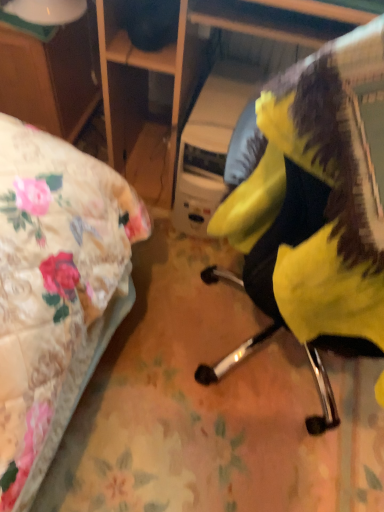
Question: From the image's perspective, is yellow fabric chair at center above or below wooden desk at left?

Choices:
 (A) below
 (B) above

Answer: (A)

Question: Considering the positions of point (327, 200) and point (49, 115), is point (327, 200) closer or farther from the camera than point (49, 115)?

Choices:
 (A) farther
 (B) closer

Answer: (B)

Question: In terms of height, does yellow fabric chair at center look taller or shorter compared to wooden desk at left?

Choices:
 (A) short
 (B) tall

Answer: (B)

Question: Is wooden desk at left wider or thinner than yellow fabric chair at center?

Choices:
 (A) wide
 (B) thin

Answer: (B)

Question: Is wooden desk at left spatially inside yellow fabric chair at center, or outside of it?

Choices:
 (A) inside
 (B) outside

Answer: (B)

Question: From a real-world perspective, is wooden desk at left positioned above or below yellow fabric chair at center?

Choices:
 (A) below
 (B) above

Answer: (A)

Question: From their relative heights in the image, would you say wooden desk at left is taller or shorter than yellow fabric chair at center?

Choices:
 (A) short
 (B) tall

Answer: (A)